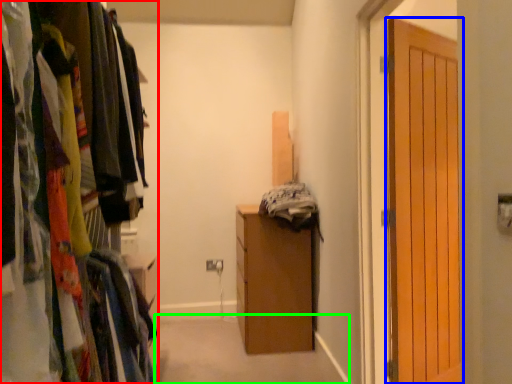
Question: Which object is the closest to the cabinetry (highlighted by a red box)? Choose among these: door (highlighted by a blue box) or path (highlighted by a green box).

Choices:
 (A) door
 (B) path

Answer: (A)